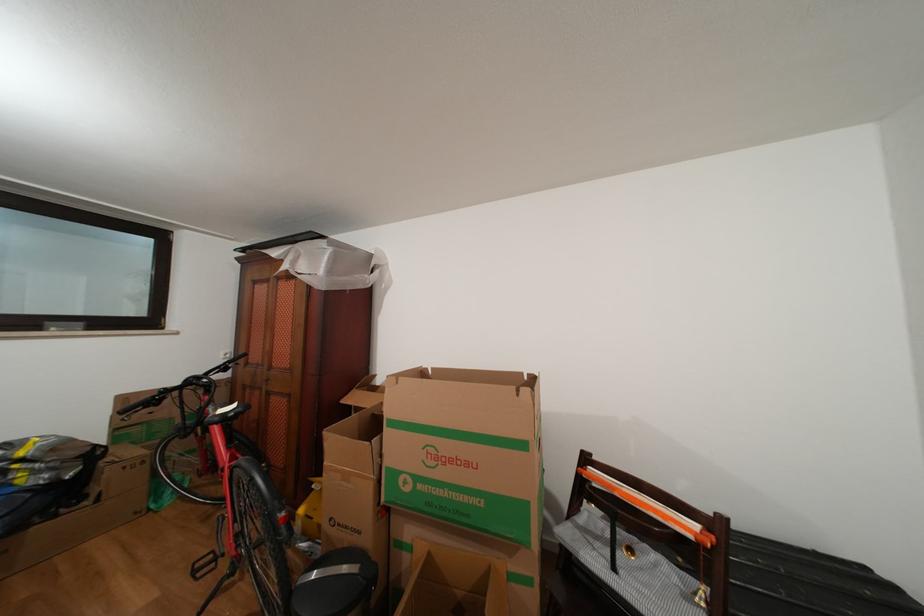
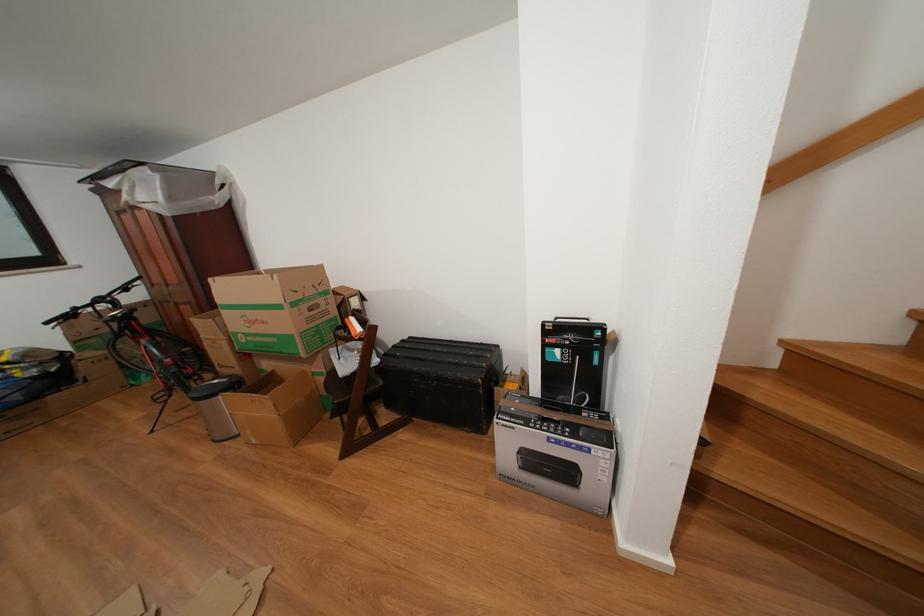
Locate, in the second image, the point that corresponds to the point at 476,469 in the first image.

(272, 328)